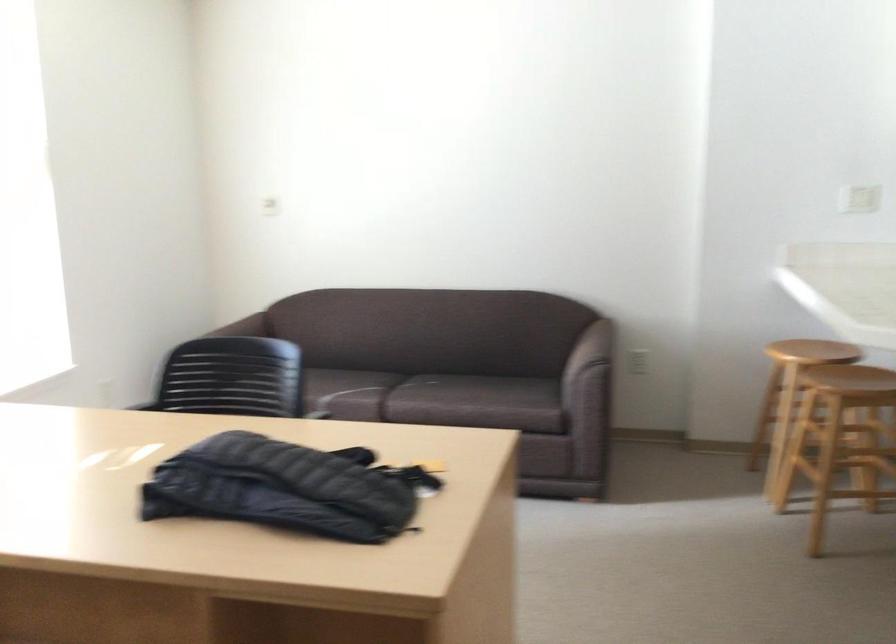
Where would you sit the brown sofa sitting surface? Please return your answer as a coordinate pair (x, y).

(475, 401)